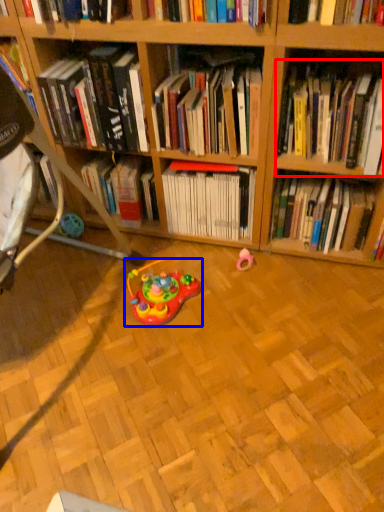
Question: Which point is closer to the camera, book (highlighted by a red box) or toy (highlighted by a blue box)?

Choices:
 (A) book
 (B) toy

Answer: (A)